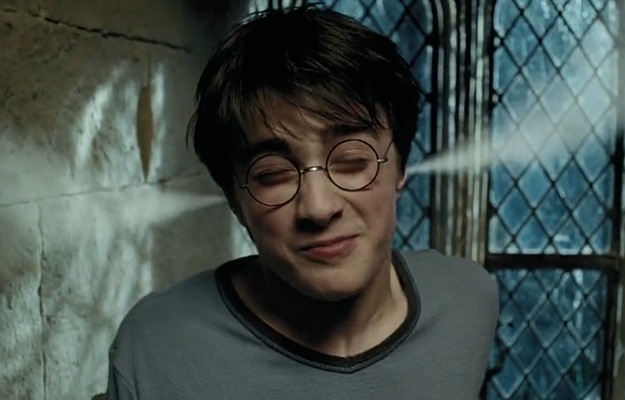
The height and width of the screenshot is (400, 625). In order to click on brick wall in this screenshot , I will do `click(107, 158)`.